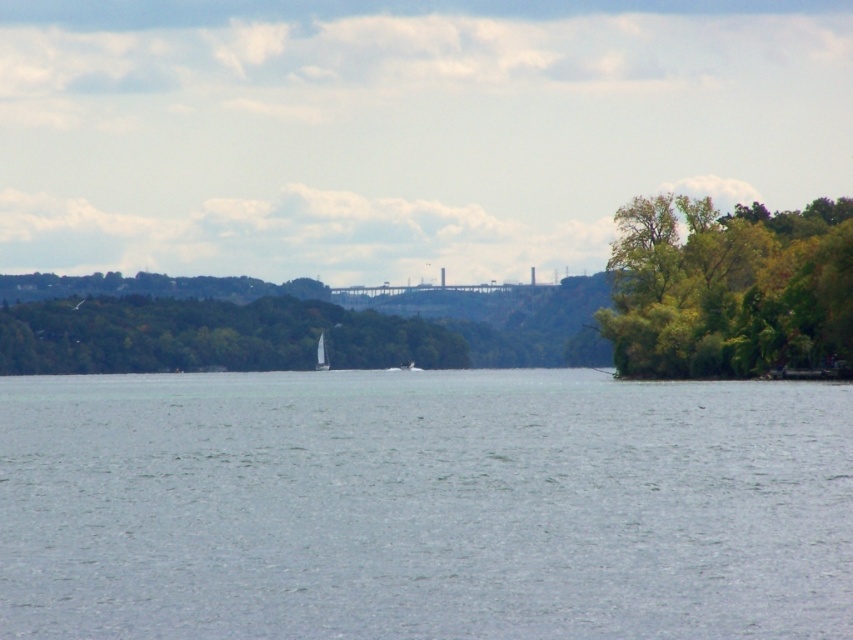
Question: Does clear water at center lie behind green leafy trees at right?

Choices:
 (A) yes
 (B) no

Answer: (B)

Question: Among these objects, which one is nearest to the camera?

Choices:
 (A) green leafy trees at right
 (B) clear water at center
 (C) white sailboat at center

Answer: (B)

Question: Which of the following is the farthest from the observer?

Choices:
 (A) green leafy trees at right
 (B) clear water at center
 (C) white sailboat at center

Answer: (C)

Question: Does green leafy trees at right have a lesser width compared to white sailboat at center?

Choices:
 (A) no
 (B) yes

Answer: (A)

Question: Among these objects, which one is farthest from the camera?

Choices:
 (A) green leafy trees at right
 (B) white sailboat at center
 (C) clear water at center

Answer: (B)

Question: Does clear water at center lie behind white sailboat at center?

Choices:
 (A) yes
 (B) no

Answer: (B)